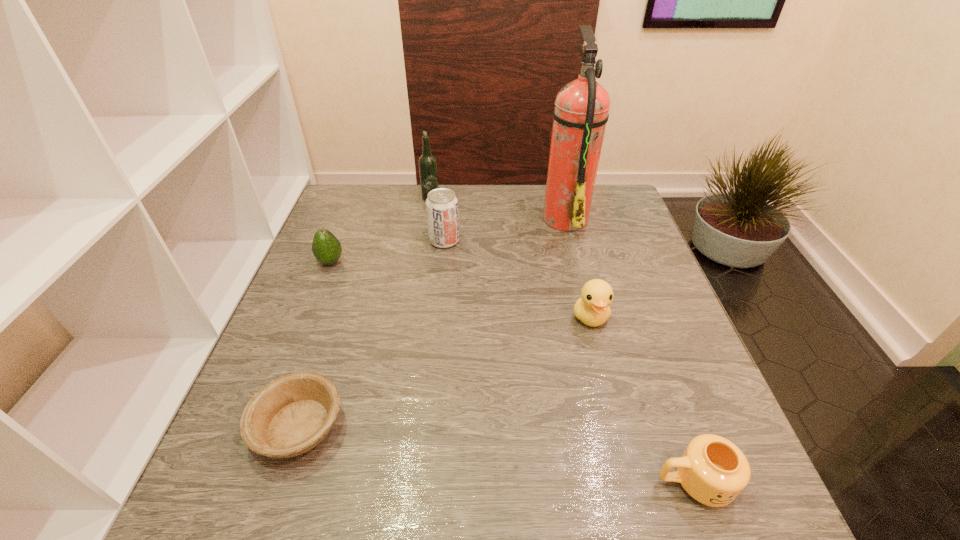
Identify the location of vacant point located between the sixth shortest object and the mug. (563, 339).

Locate an element on the screen. empty space between the soda can and the avocado is located at coordinates (388, 251).

Find the location of a particular element. The height and width of the screenshot is (540, 960). vacant space that's between the mug and the fire extinguisher is located at coordinates (629, 349).

At what (x,y) coordinates should I click in order to perform the action: click on free space between the fourth farthest object and the shortest object. Please return your answer as a coordinate pair (x, y). This screenshot has width=960, height=540. Looking at the image, I should click on (x=315, y=345).

Locate which object ranks in proximity to the mug. Please provide its 2D coordinates. Your answer should be formatted as a tuple, i.e. [(x, y)], where the tuple contains the x and y coordinates of a point satisfying the conditions above.

[(592, 308)]

Identify which object is the sixth nearest to the mug. Please provide its 2D coordinates. Your answer should be formatted as a tuple, i.e. [(x, y)], where the tuple contains the x and y coordinates of a point satisfying the conditions above.

[(427, 162)]

Locate an element on the screen. The image size is (960, 540). vacant region that satisfies the following two spatial constraints: 1. on the back side of the bowl; 2. on the right side of the soda can is located at coordinates (361, 241).

At what (x,y) coordinates should I click in order to perform the action: click on free location that satisfies the following two spatial constraints: 1. on the back side of the sixth shortest object; 2. on the left side of the avocado. Please return your answer as a coordinate pair (x, y). Looking at the image, I should click on (357, 195).